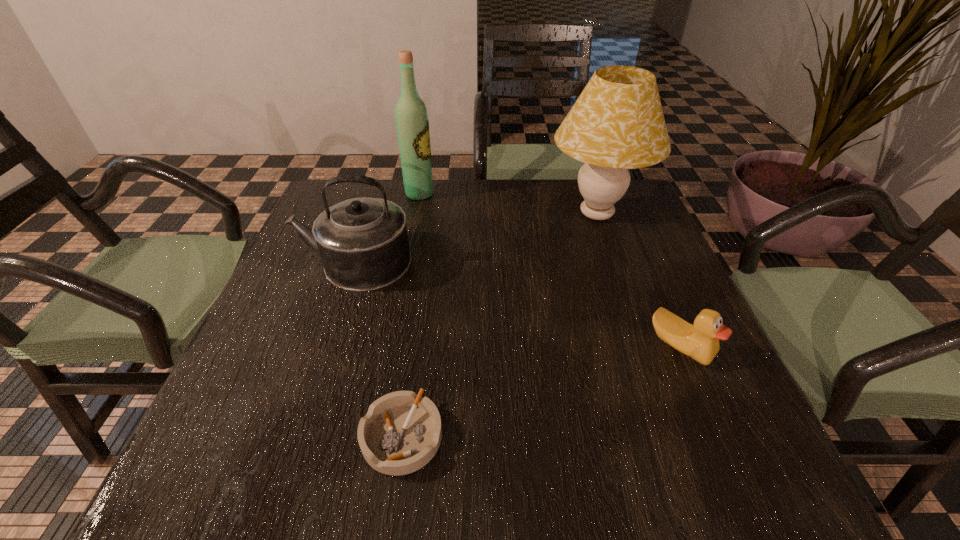
Where is `wine bottle`? Image resolution: width=960 pixels, height=540 pixels. wine bottle is located at coordinates [412, 123].

I want to click on lampshade, so click(x=617, y=123).

Locate an element on the screen. the third tallest object is located at coordinates (363, 243).

Image resolution: width=960 pixels, height=540 pixels. In order to click on duck in this screenshot , I will do `click(700, 342)`.

Image resolution: width=960 pixels, height=540 pixels. I want to click on the fourth farthest object, so click(x=700, y=342).

This screenshot has height=540, width=960. What are the coordinates of `ashtray` in the screenshot? It's located at (401, 432).

Where is `the shortest object`? This screenshot has height=540, width=960. the shortest object is located at coordinates (401, 432).

This screenshot has height=540, width=960. I want to click on free space located on the front-facing side of the wine bottle, so click(492, 194).

At what (x,y) coordinates should I click in order to perform the action: click on free region located 0.200m on the left of the lampshade. Please return your answer as a coordinate pair (x, y). Image resolution: width=960 pixels, height=540 pixels. Looking at the image, I should click on (473, 214).

This screenshot has width=960, height=540. Identify the location of free space located at the beak of the duck. (727, 454).